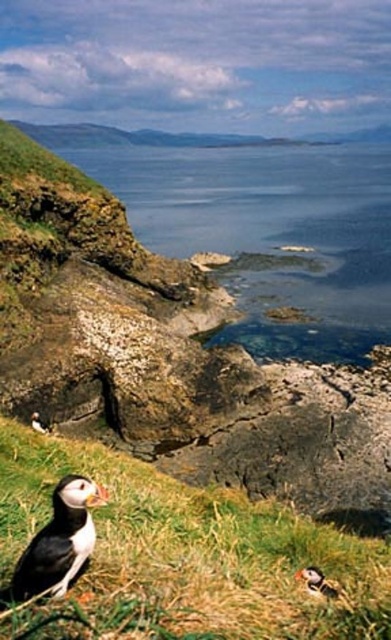
You are a birdwatcher observing the coastal scene. You notice two points marked in the image. The first point is at coordinates point [87,506] and the second at point [48,424]. Which of these points is closer to you, the observer?

Point [87,506] is in front of point [48,424], so the first point is closer to you.

You are standing at the base of the cliffs and want to take a photo of the two points marked in the image. Which point, point (308,620) or point (279,147), will appear larger in your photo?

Point (308,620) will appear larger in the photo because it is closer to the camera than point (279,147).

In the scene shown: You are a photographer trying to capture the black feathered puffin at lower left and the green grassy at lower left in the same frame. Based on the scene, which of the two has a smaller visual width in the image?

The green grassy at lower left has a lesser width compared to the black feathered puffin at lower left, so the green grassy at lower left is smaller in width.